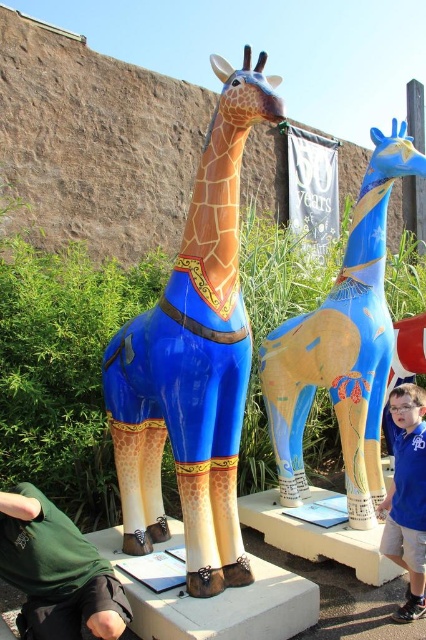
Does glossy painted giraffe at center have a smaller size compared to green fabric shirt at lower left?

Incorrect, glossy painted giraffe at center is not smaller in size than green fabric shirt at lower left.

Can you confirm if glossy painted giraffe at center is taller than green fabric shirt at lower left?

Yes, glossy painted giraffe at center is taller than green fabric shirt at lower left.

Where is `glossy painted giraffe at center`? This screenshot has height=640, width=426. glossy painted giraffe at center is located at coordinates (193, 360).

Is blue glossy giraffe at center shorter than green fabric shirt at lower left?

In fact, blue glossy giraffe at center may be taller than green fabric shirt at lower left.

This screenshot has height=640, width=426. Find the location of `blue glossy giraffe at center`. blue glossy giraffe at center is located at coordinates (342, 346).

Is point (342, 300) positioned behind point (19, 509)?

Yes, point (342, 300) is behind point (19, 509).

You are a GUI agent. You are given a task and a screenshot of the screen. Output one action in this format:
    pyautogui.click(x=<x>, y=<y>)
    Task: Click on the blue glossy giraffe at center
    
    Given the screenshot: What is the action you would take?
    click(342, 346)

Where is `glossy painted giraffe at center`? Image resolution: width=426 pixels, height=640 pixels. glossy painted giraffe at center is located at coordinates (193, 360).

Looking at this image, is glossy painted giraffe at center thinner than blue fabric shirt at lower right?

No.

This screenshot has height=640, width=426. I want to click on glossy painted giraffe at center, so click(193, 360).

This screenshot has width=426, height=640. In order to click on glossy painted giraffe at center in this screenshot , I will do `click(193, 360)`.